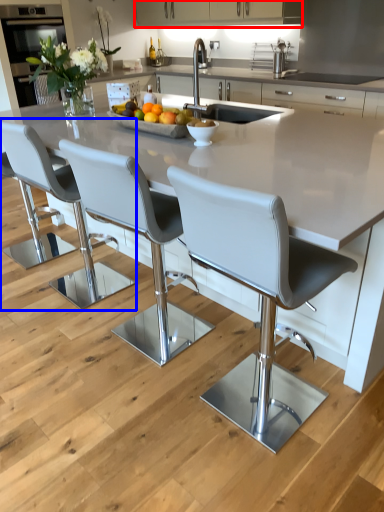
Question: Which point is further to the camera, cabinetry (highlighted by a red box) or chair (highlighted by a blue box)?

Choices:
 (A) cabinetry
 (B) chair

Answer: (A)